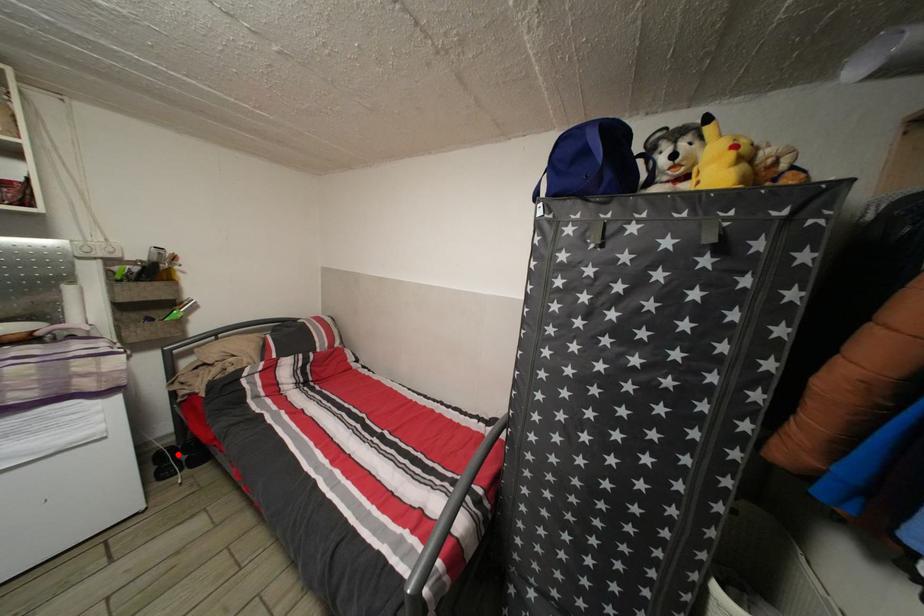
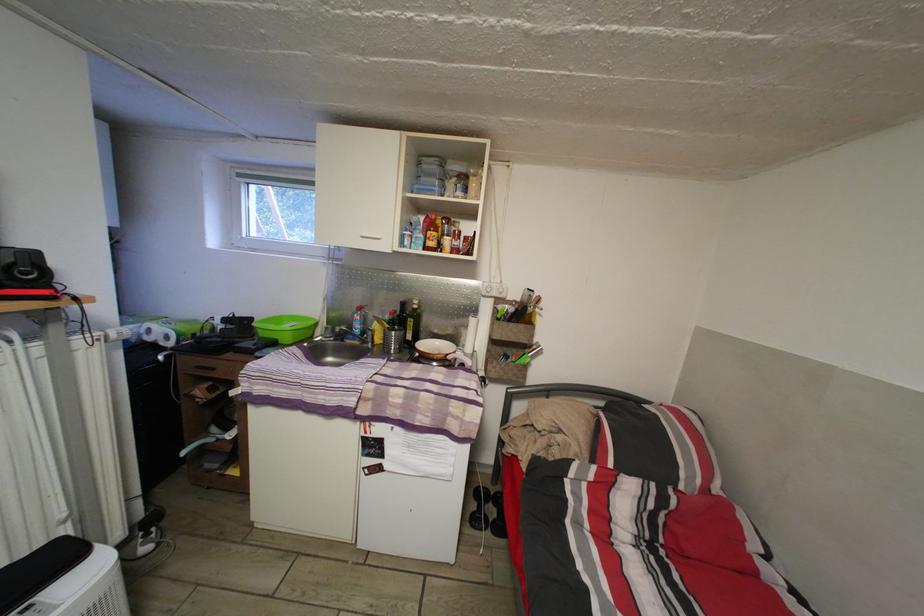
In the second image, find the point that corresponds to the highlighted location in the first image.

(493, 498)